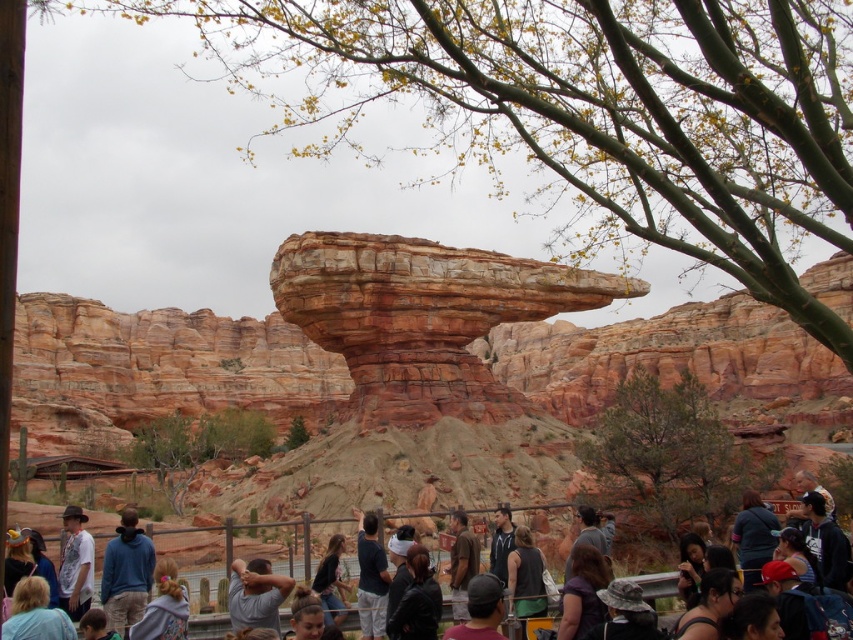
Question: Is blonde hair at lower left thinner than denim jacket at center?

Choices:
 (A) yes
 (B) no

Answer: (B)

Question: Can you confirm if dark gray clothing at center is positioned to the left of denim jacket at center?

Choices:
 (A) no
 (B) yes

Answer: (A)

Question: Which object is the closest to the dark gray clothing at center?

Choices:
 (A) blonde hair at lower left
 (B) denim jacket at center
 (C) matte black sunglasses at lower right
 (D) dark brown hair at lower center

Answer: (B)

Question: Which point is farther from the camera taking this photo?

Choices:
 (A) (718, 595)
 (B) (438, 616)
 (C) (331, 612)

Answer: (C)

Question: Which object appears closest to the camera in this image?

Choices:
 (A) dark gray clothing at center
 (B) matte black sunglasses at lower right
 (C) blonde hair at lower left

Answer: (C)

Question: Can you confirm if black leather jacket at center is positioned to the right of matte black sunglasses at lower right?

Choices:
 (A) yes
 (B) no

Answer: (B)